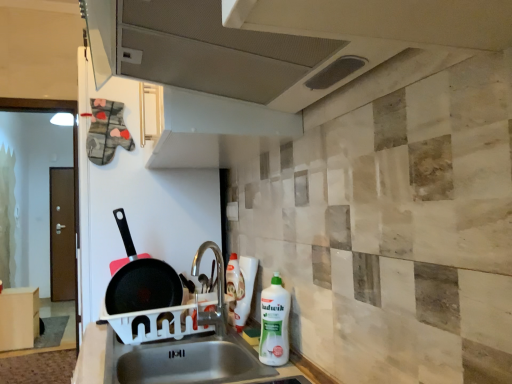
Question: From the image's perspective, is white plastic bottle at lower right above or below metallic gray exhaust hood at upper center?

Choices:
 (A) below
 (B) above

Answer: (A)

Question: In terms of width, does white plastic bottle at lower right look wider or thinner when compared to metallic gray exhaust hood at upper center?

Choices:
 (A) wide
 (B) thin

Answer: (B)

Question: Which object is the farthest from the non-stick black frying pan at left?

Choices:
 (A) white plastic bottle at lower right
 (B) light wood/wooden cabinet at lower left
 (C) white glossy bottle at center
 (D) metallic gray exhaust hood at upper center
 (E) white plastic sink at lower center

Answer: (B)

Question: Based on their relative distances, which object is nearer to the white plastic sink at lower center?

Choices:
 (A) light wood/wooden cabinet at lower left
 (B) white glossy bottle at center
 (C) white plastic bottle at lower right
 (D) metallic gray exhaust hood at upper center
 (E) non-stick black frying pan at left

Answer: (E)